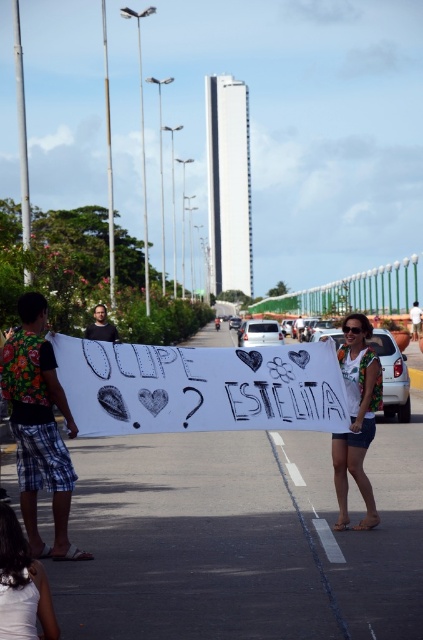
Question: Does white fabric sign at center appear over white fabric at lower left?

Choices:
 (A) no
 (B) yes

Answer: (B)

Question: Which of the following is the closest to the observer?

Choices:
 (A) (375, 360)
 (B) (14, 520)

Answer: (B)

Question: Is white fabric sign at center thinner than white fabric at lower left?

Choices:
 (A) no
 (B) yes

Answer: (A)

Question: Does white fabric sign at center have a lesser width compared to white fabric at lower left?

Choices:
 (A) yes
 (B) no

Answer: (B)